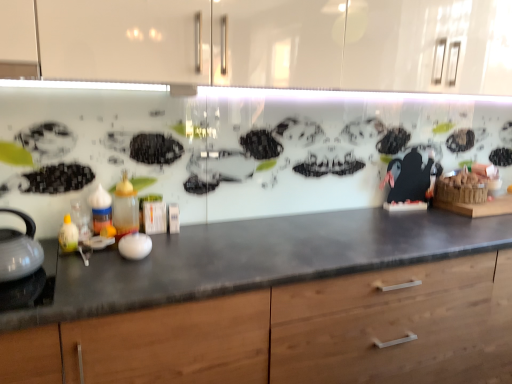
Question: Can you confirm if white glossy tea pot at left is shorter than wooden cabinet at center?

Choices:
 (A) no
 (B) yes

Answer: (B)

Question: Considering the relative sizes of white glossy tea pot at left and wooden cabinet at center in the image provided, is white glossy tea pot at left thinner than wooden cabinet at center?

Choices:
 (A) no
 (B) yes

Answer: (B)

Question: From the image's perspective, is white glossy tea pot at left located beneath wooden cabinet at center?

Choices:
 (A) no
 (B) yes

Answer: (A)

Question: From the image's perspective, is white glossy tea pot at left located above wooden cabinet at center?

Choices:
 (A) yes
 (B) no

Answer: (A)

Question: Does white glossy tea pot at left appear on the left side of wooden cabinet at center?

Choices:
 (A) yes
 (B) no

Answer: (A)

Question: Is white glossy tea pot at left facing away from wooden cabinet at center?

Choices:
 (A) yes
 (B) no

Answer: (B)

Question: Is white glossy tea pot at left located outside translucent plastic bottle at left, placed as the 1th bottle when sorted from left to right?

Choices:
 (A) no
 (B) yes

Answer: (B)

Question: Could you tell me if white glossy tea pot at left is turned towards translucent plastic bottle at left, the second bottle from the right?

Choices:
 (A) yes
 (B) no

Answer: (B)

Question: Does white glossy tea pot at left have a lesser height compared to translucent plastic bottle at left, placed as the 1th bottle when sorted from left to right?

Choices:
 (A) yes
 (B) no

Answer: (B)

Question: Is white glossy tea pot at left surrounding translucent plastic bottle at left, the second bottle from the right?

Choices:
 (A) no
 (B) yes

Answer: (A)

Question: Is white glossy tea pot at left looking in the opposite direction of translucent plastic bottle at left, the second bottle from the right?

Choices:
 (A) yes
 (B) no

Answer: (B)

Question: From a real-world perspective, is white glossy tea pot at left physically below translucent plastic bottle at left, the second bottle from the right?

Choices:
 (A) yes
 (B) no

Answer: (B)

Question: Is translucent plastic bottle at center, which is the 1th bottle from right to left, bigger than translucent plastic bottle at left, the second bottle from the right?

Choices:
 (A) yes
 (B) no

Answer: (A)